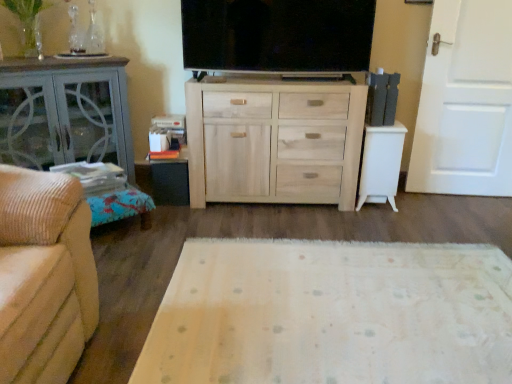
Question: Would you say white wooden door at right is to the left or to the right of white glossy side table at right, the 1th table from the right, in the picture?

Choices:
 (A) left
 (B) right

Answer: (B)

Question: Based on their sizes in the image, would you say white wooden door at right is bigger or smaller than white glossy side table at right, the 1th table from the right?

Choices:
 (A) big
 (B) small

Answer: (A)

Question: Which object is positioned farthest from the light wood/unfinished chest of drawers at center?

Choices:
 (A) white wooden door at right
 (B) flat screen tv at center
 (C) matte gray cabinet at left, the first table viewed from the left
 (D) white glossy side table at right, the 1th table from the right
 (E) black matte table at lower left, placed as the second table when sorted from right to left

Answer: (A)

Question: Which is farther from the flat screen tv at center?

Choices:
 (A) black matte table at lower left, placed as the second table when sorted from right to left
 (B) light wood/unfinished chest of drawers at center
 (C) white wooden door at right
 (D) matte gray cabinet at left, placed as the third table when sorted from right to left
 (E) white glossy side table at right, the 1th table from the right

Answer: (C)